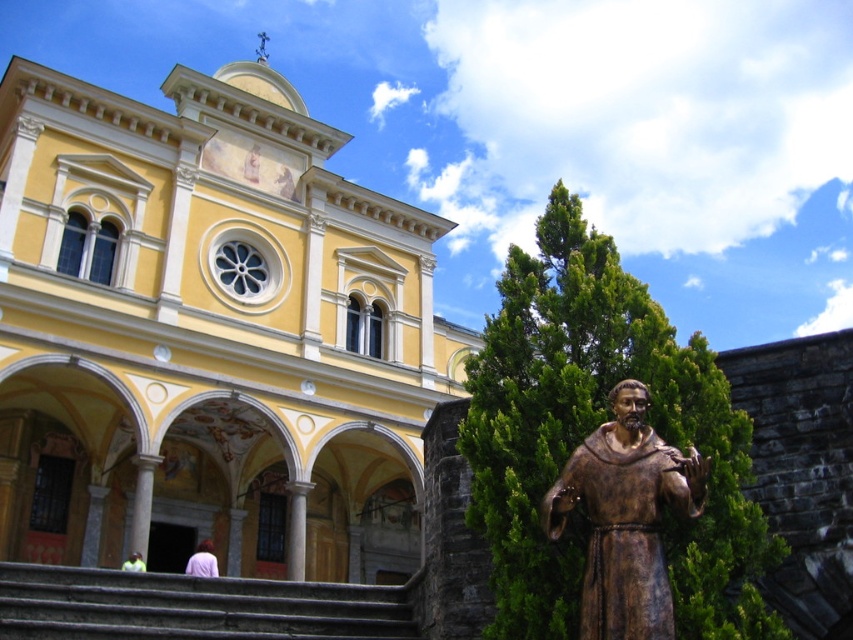
Question: Does gray concrete stairs at lower left have a larger size compared to white fabric at lower center?

Choices:
 (A) no
 (B) yes

Answer: (B)

Question: Which point is farther to the camera?

Choices:
 (A) (206, 566)
 (B) (280, 588)

Answer: (A)

Question: Which point appears farthest from the camera in this image?

Choices:
 (A) (90, 586)
 (B) (62, 556)

Answer: (B)

Question: Which point is farther to the camera?

Choices:
 (A) (73, 96)
 (B) (9, 577)
 (C) (125, 561)

Answer: (A)

Question: Is gray concrete stairs at lower left above white fabric at lower center?

Choices:
 (A) no
 (B) yes

Answer: (B)

Question: Can you confirm if yellow painted stone church at upper left is wider than gray concrete stairs at lower left?

Choices:
 (A) no
 (B) yes

Answer: (B)